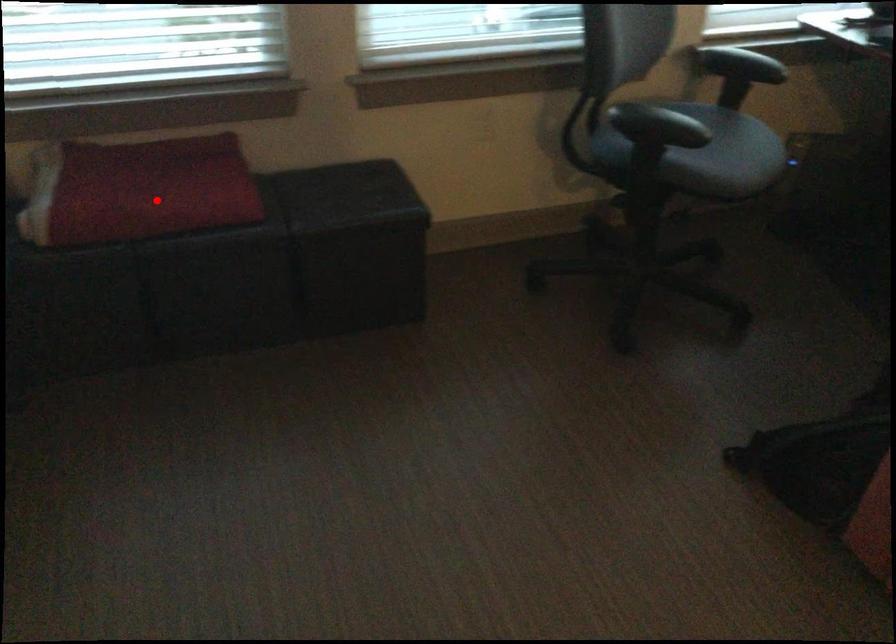
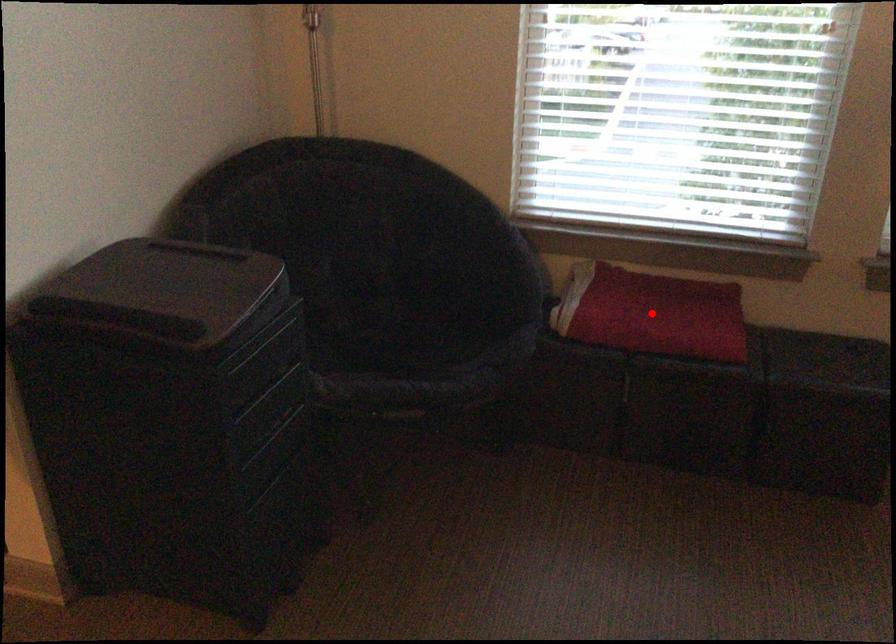
I am providing you with two images of the same scene from different viewpoints. A red point is marked on the first image and another point is marked on the second image. Does the point marked in image1 correspond to the same location as the one in image2?

Yes